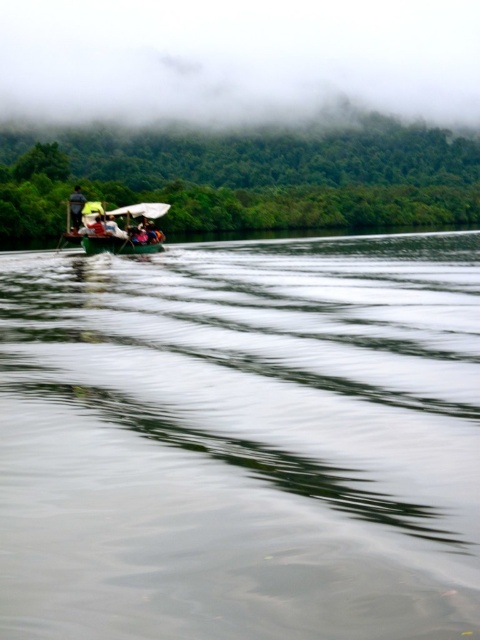
You are planning to take a boat ride and need to choose between the green plastic canoe at center and the green fabric boat at center. Which one offers more headroom for taller passengers?

The green plastic canoe at center has a greater height compared to the green fabric boat at center, so it offers more headroom for taller passengers.

You are a tour guide leading a group on a serene lake. You have two boats available for your guests to choose from. The green rubber boat at upper left and the green plastic canoe at center. Your guests want to know if they can safely move from one boat to the other using a small floating platform. The platform is 15 feet long. Can they do this?

The green rubber boat at upper left and green plastic canoe at center are 20.33 feet apart from each other. Since the platform is only 15 feet long, it is not long enough to bridge the gap between the two boats. The guests would need a longer platform to safely move between them.

You are planning to take a boat ride on the lake. You have to choose between the green rubber boat at upper left and the green plastic canoe at center. Which one can accommodate more passengers?

The green rubber boat at upper left is bigger than the green plastic canoe at center, so it can accommodate more passengers.